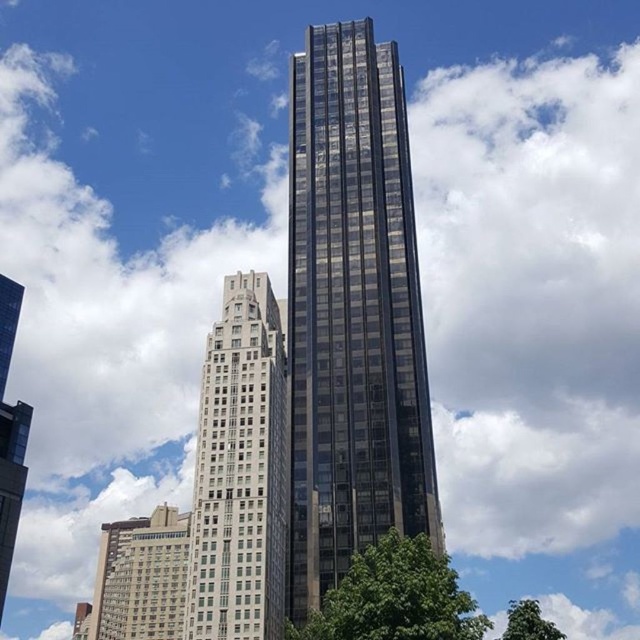
Does glassy black skyscraper at center have a lesser height compared to green leafy tree at lower right?

Correct, glassy black skyscraper at center is not as tall as green leafy tree at lower right.

The image size is (640, 640). What do you see at coordinates (353, 314) in the screenshot? I see `glassy black skyscraper at center` at bounding box center [353, 314].

This screenshot has width=640, height=640. I want to click on glassy black skyscraper at center, so click(x=353, y=314).

Measure the distance between glassy black skyscraper at center and green leafy tree at lower center.

glassy black skyscraper at center is 24.82 meters from green leafy tree at lower center.

Who is more forward, (401, 200) or (390, 561)?

Point (390, 561) is more forward.

Find the location of `glassy black skyscraper at center`. glassy black skyscraper at center is located at coordinates (353, 314).

Can you confirm if glassy black skyscraper at center is wider than white textured building at lower left?

No.

Between glassy black skyscraper at center and white textured building at lower left, which one appears on the left side from the viewer's perspective?

white textured building at lower left is more to the left.

Describe the element at coordinates (353, 314) in the screenshot. This screenshot has height=640, width=640. I see `glassy black skyscraper at center` at that location.

Where is `glassy black skyscraper at center`? Image resolution: width=640 pixels, height=640 pixels. glassy black skyscraper at center is located at coordinates (353, 314).